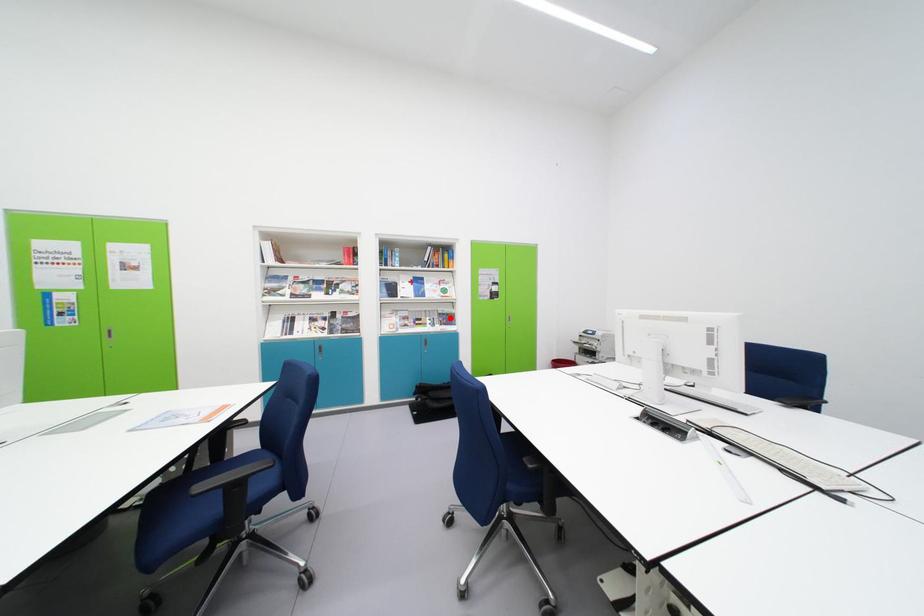
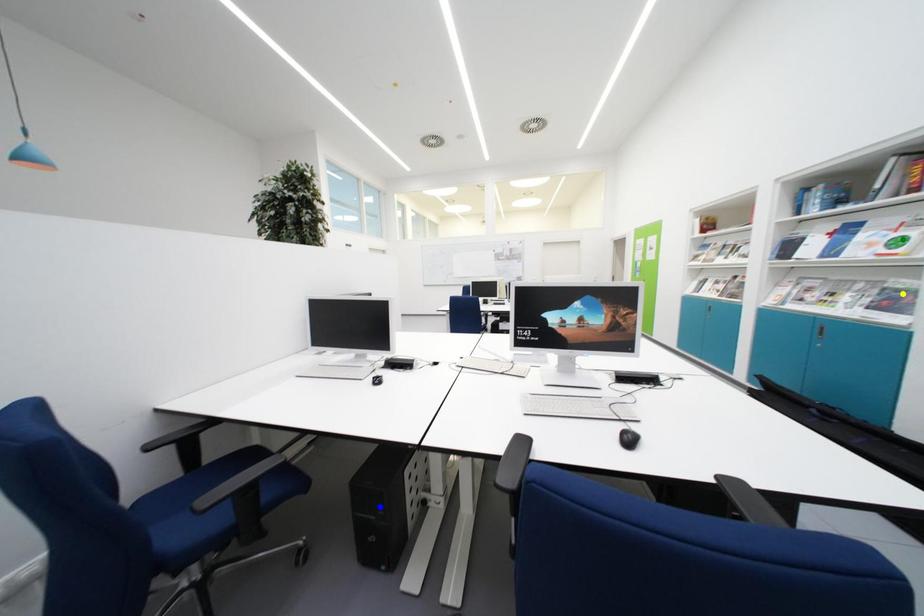
Question: I am providing you with two images of the same scene from different viewpoints. A red point is marked on the first image. You are given multiple points on the second image. Which mark in image 2 goes with the point in image 1?

Choices:
 (A) blue point
 (B) yellow point
 (C) green point

Answer: (B)